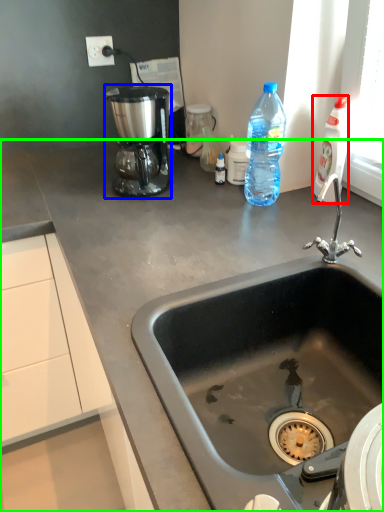
Question: Considering the real-world distances, which object is farthest from bottle (highlighted by a red box)? coffee maker (highlighted by a blue box) or countertop (highlighted by a green box)?

Choices:
 (A) coffee maker
 (B) countertop

Answer: (A)